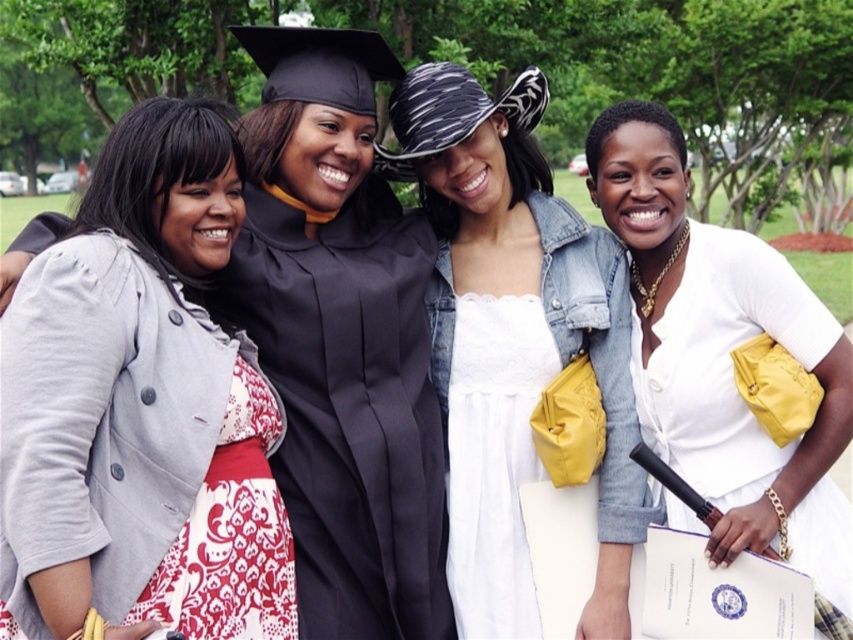
Looking at the scene, where is the white satin dress at center in relation to the white damask fabric dress at lower left?

The white satin dress at center is to the right of the white damask fabric dress at lower left.

You are planning to sit between the two women wearing dresses at the center. Which dress, the white matte dress at center or the white lace dress at center, would you need to leave more space for on your left side?

The white matte dress at center is wider than the white lace dress at center, so you would need to leave more space for the white matte dress at center on your left side.

You are a photographer trying to capture a closeup shot of both the white satin dress at center and the white damask fabric dress at lower left. Given that your camera can only focus on one dress at a time, which dress should you focus on to ensure the subject appears larger in the photo?

The white satin dress at center should be focused on because it has a larger size compared to the white damask fabric dress at lower left, making it the better choice for a larger appearance in the photo.